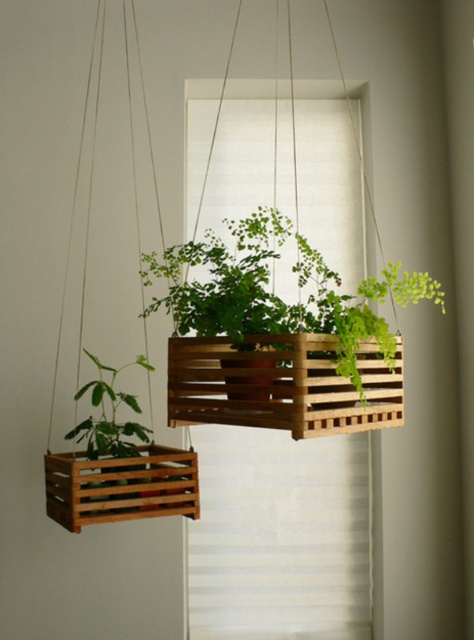
Question: Can you confirm if wooden slats at center is bigger than brown wooden crate at left?

Choices:
 (A) no
 (B) yes

Answer: (A)

Question: Is green wooden crate at center thinner than green matte plant at left?

Choices:
 (A) yes
 (B) no

Answer: (B)

Question: Can you confirm if green wooden crate at center is bigger than green matte plant at left?

Choices:
 (A) yes
 (B) no

Answer: (A)

Question: Among these points, which one is farthest from the camera?

Choices:
 (A) (367, 358)
 (B) (124, 513)

Answer: (B)

Question: Which point is farther to the camera?

Choices:
 (A) tap(364, 364)
 (B) tap(79, 486)

Answer: (B)

Question: Which point is closer to the camera?

Choices:
 (A) (139, 257)
 (B) (125, 486)
 (C) (231, 276)

Answer: (C)